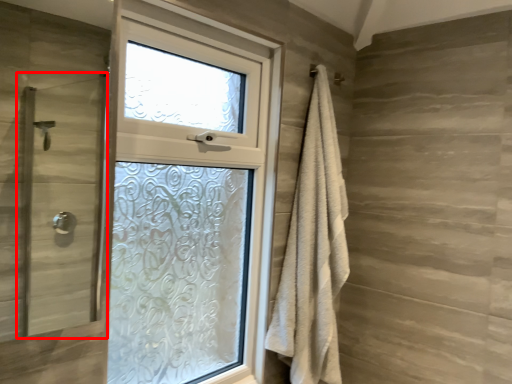
Question: Considering the relative positions of screen door (annotated by the red box) and bath towel in the image provided, where is screen door (annotated by the red box) located with respect to the staircase?

Choices:
 (A) left
 (B) right

Answer: (A)